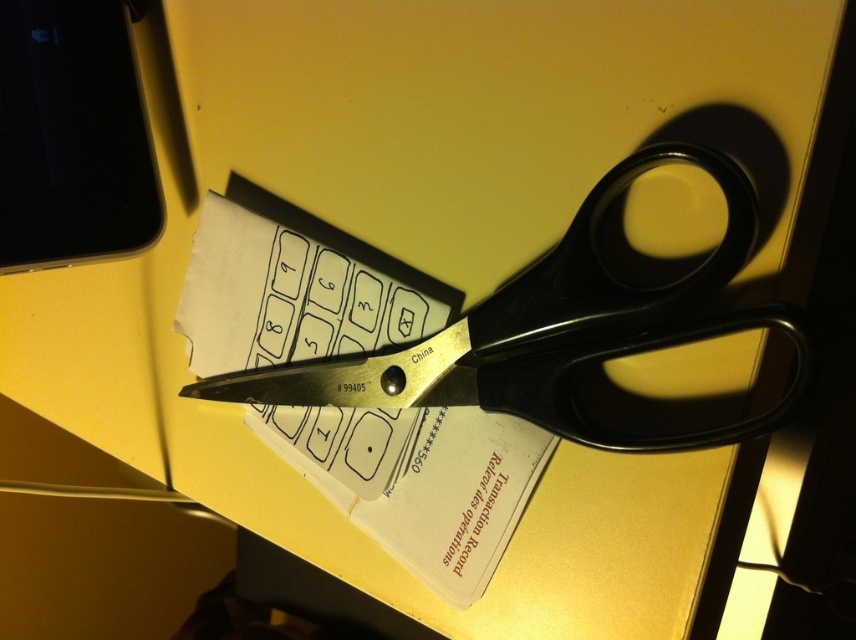
Does white paper at center have a greater height compared to black plastic scissors at center?

Yes, white paper at center is taller than black plastic scissors at center.

Between white paper at center and black plastic scissors at center, which one is positioned higher?

black plastic scissors at center is above.

Find the location of `white paper at center`. white paper at center is located at coordinates (418, 481).